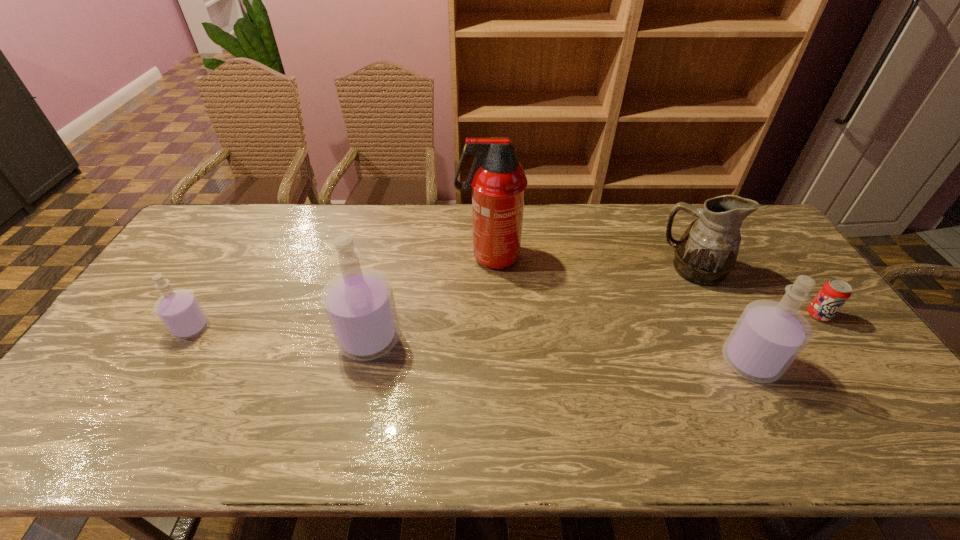
You are a GUI agent. You are given a task and a screenshot of the screen. Output one action in this format:
    pyautogui.click(x=<x>, y=<y>)
    Task: Click on the leftmost perfume
    Image resolution: width=960 pixels, height=540 pixels.
    Given the screenshot: What is the action you would take?
    pyautogui.click(x=179, y=310)

The image size is (960, 540). What are the coordinates of `the shortest perfume` in the screenshot? It's located at (179, 310).

Locate an element on the screen. This screenshot has height=540, width=960. the second object from left to right is located at coordinates (359, 303).

Locate an element on the screen. the second shortest perfume is located at coordinates (769, 335).

Find the location of a particular element. This screenshot has height=540, width=960. pitcher is located at coordinates (706, 253).

Identify the location of the fourth object from right to left. The width and height of the screenshot is (960, 540). (497, 180).

Find the location of a particular element. The image size is (960, 540). soda can is located at coordinates (834, 293).

This screenshot has width=960, height=540. I want to click on the shortest object, so click(834, 293).

You are a GUI agent. You are given a task and a screenshot of the screen. Output one action in this format:
    pyautogui.click(x=<x>, y=<y>)
    Task: Click on the vacant space positioned on the back of the shortest perfume
    
    Given the screenshot: What is the action you would take?
    pyautogui.click(x=230, y=263)

The width and height of the screenshot is (960, 540). Identify the location of vacant space located on the back of the fifth object from right to left. (393, 236).